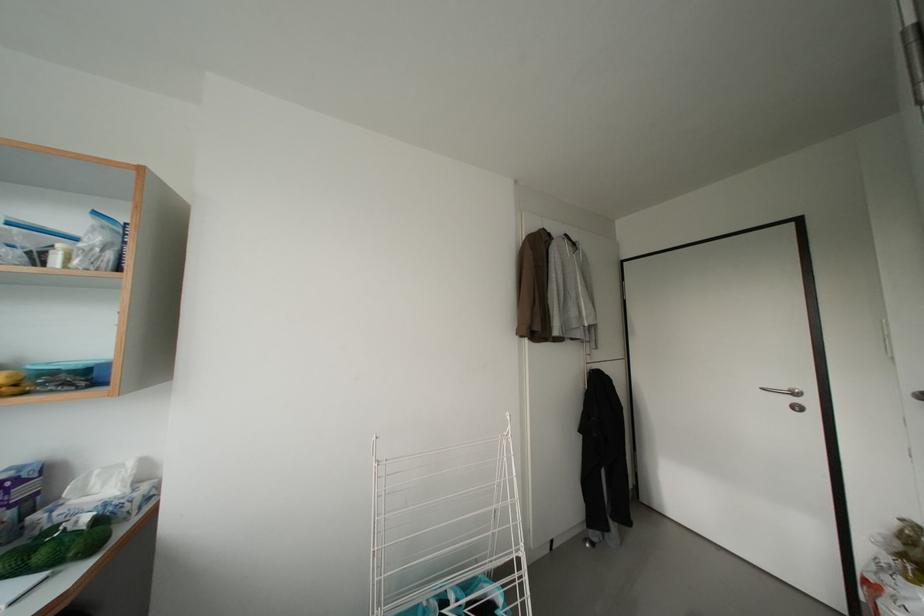
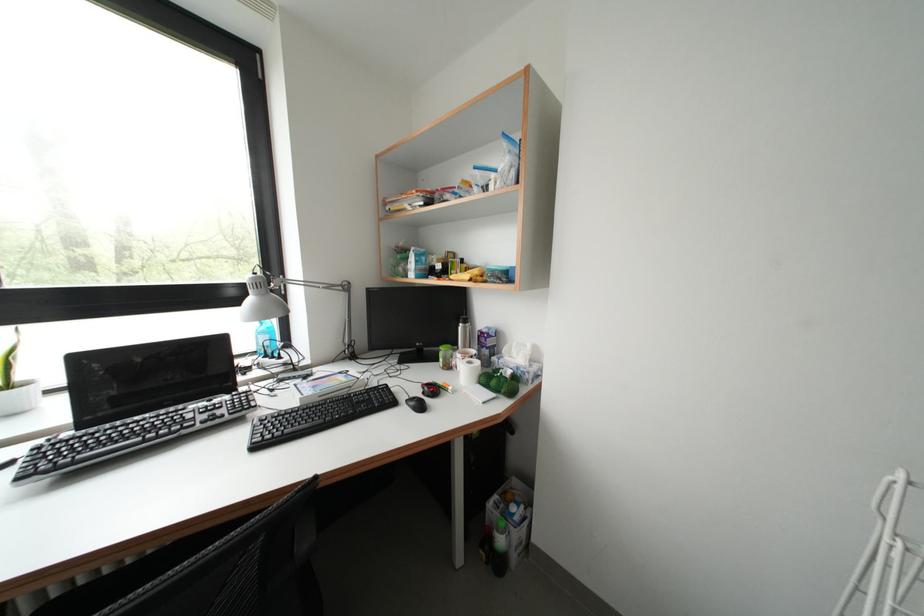
The point at (49, 561) is marked in the first image. Where is the corresponding point in the second image?

(500, 387)